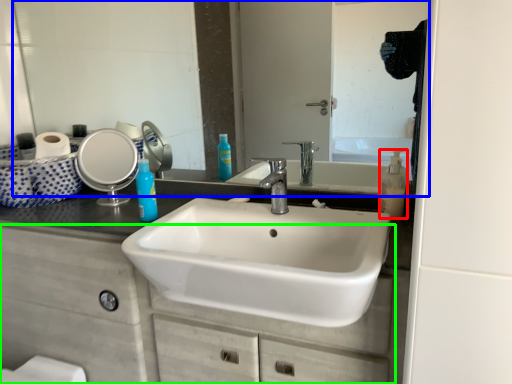
Question: Which object is positioned closest to soap dispenser (highlighted by a red box)? Select from mirror (highlighted by a blue box) and bathroom cabinet (highlighted by a green box).

Choices:
 (A) mirror
 (B) bathroom cabinet

Answer: (A)